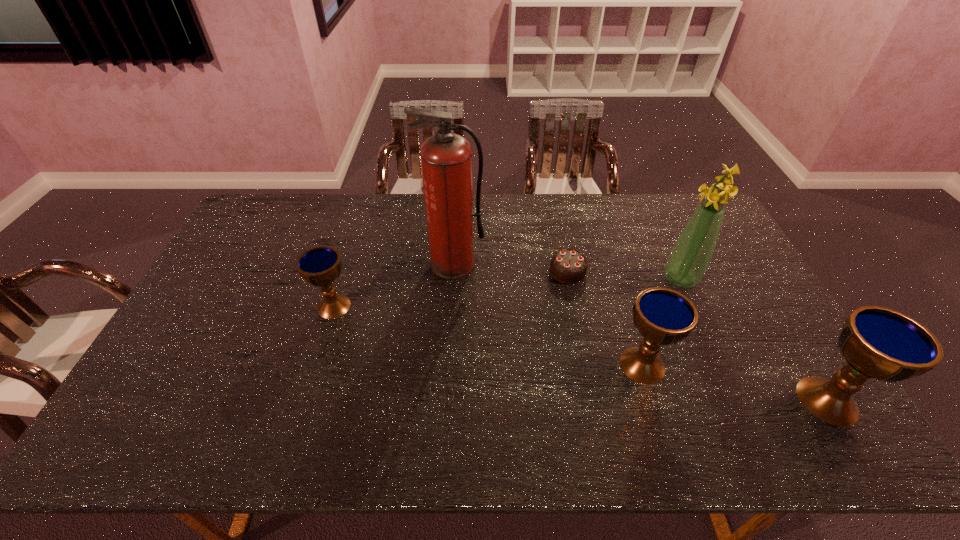
Please point a location where one more chalice can be added evenly. Please provide its 2D coordinates. Your answer should be formatted as a tuple, i.e. [(x, y)], where the tuple contains the x and y coordinates of a point satisfying the conditions above.

[(479, 334)]